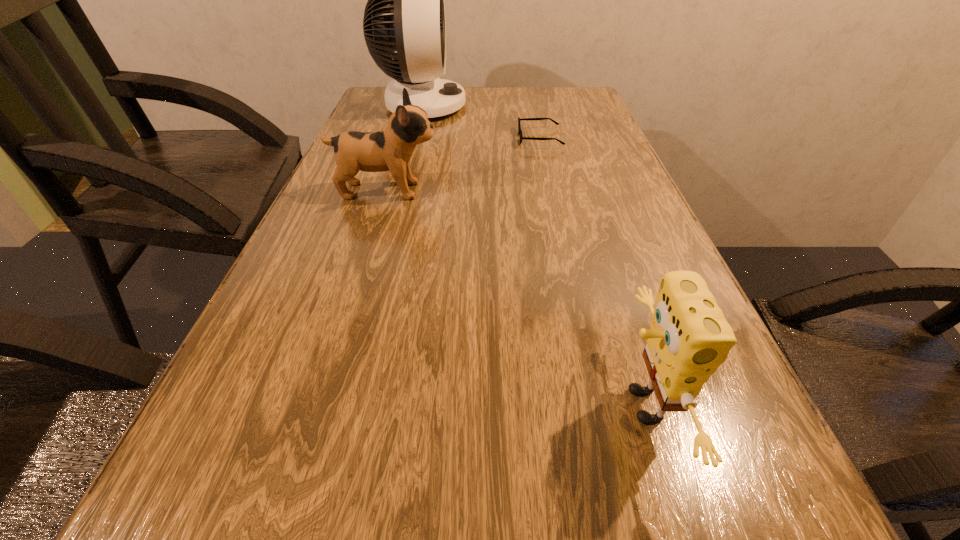
In order to click on the tallest object in this screenshot , I will do `click(405, 12)`.

Find the location of `the farthest object`. the farthest object is located at coordinates click(x=405, y=12).

In order to click on the third farthest object in this screenshot , I will do `click(390, 149)`.

I want to click on sponge, so click(689, 338).

Identify the location of the third nearest object. (519, 127).

Where is `the shortest object`? the shortest object is located at coordinates (519, 127).

This screenshot has width=960, height=540. I want to click on blank space located on the grille of the farthest object, so tap(552, 106).

Image resolution: width=960 pixels, height=540 pixels. Find the location of `vacant space located at the face of the third farthest object`. vacant space located at the face of the third farthest object is located at coordinates (561, 191).

You are a GUI agent. You are given a task and a screenshot of the screen. Output one action in this format:
    pyautogui.click(x=<x>, y=<y>)
    Task: Click on the vacant space located on the face of the sponge
    The width and height of the screenshot is (960, 540).
    Given the screenshot: What is the action you would take?
    pyautogui.click(x=486, y=406)

This screenshot has height=540, width=960. Find the location of `free space located 0.200m on the face of the sponge`. free space located 0.200m on the face of the sponge is located at coordinates (471, 406).